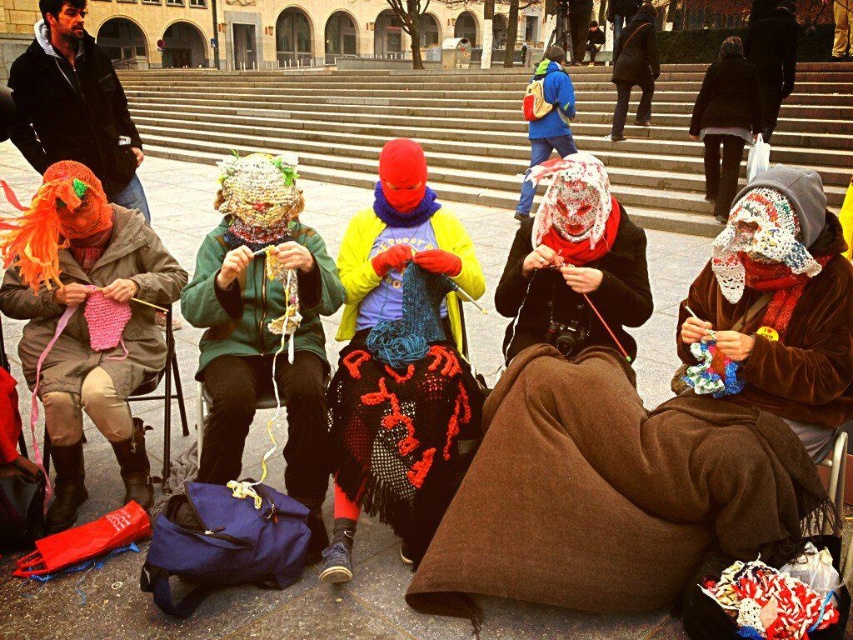
You are a knitter who wants to place both the matte pink yarn at left and the green knitted hat at center on a shelf. Which object should you place first to ensure they both fit vertically?

The matte pink yarn at left is taller than the green knitted hat at center, so you should place the taller matte pink yarn at left first to ensure both fit vertically.

You are a knitter who wants to place the matte pink yarn at left on a higher position than the green knitted hat at center. Is the current arrangement allowing that?

The matte pink yarn at left is positioned under the green knitted hat at center, so it is currently placed lower. To achieve a higher position, you would need to move the matte pink yarn at left above the green knitted hat at center.

You are a photographer trying to capture a closeup of the knitted scarf at center and the dark brown coat at upper center. Given their sizes, which object should you zoom in more on to ensure both are clearly visible in the frame?

Since the knitted scarf at center is smaller than the dark brown coat at upper center, you should zoom in more on the knitted scarf at center to balance their sizes in the photo so both are clearly visible.